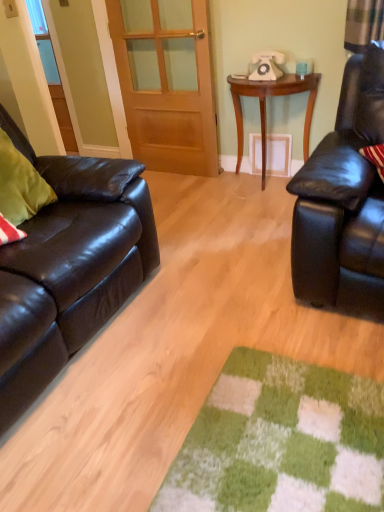
I want to click on vacant space in between wooden table at center and shiny black leather couch at left, so click(194, 242).